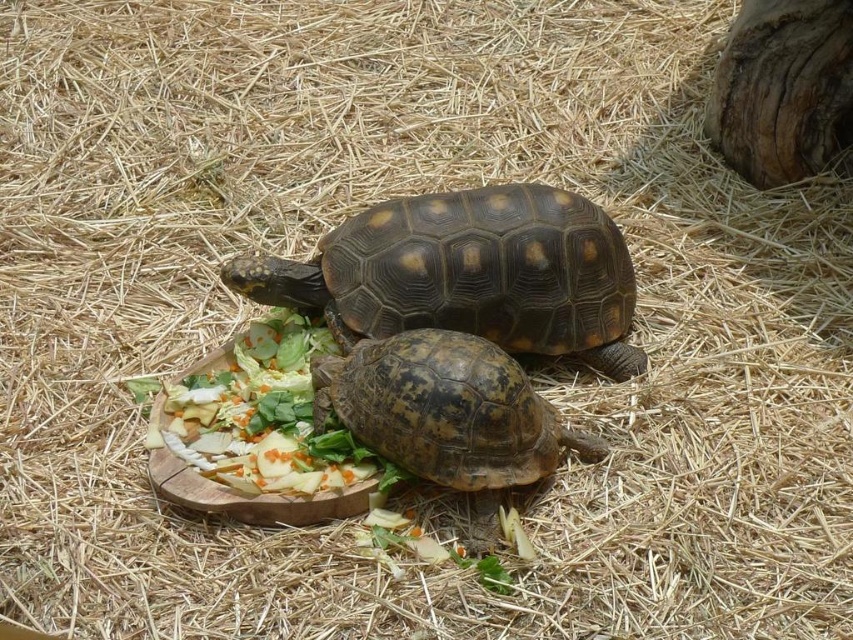
Question: Can you confirm if yellowish-brown textured shell at center is bigger than brown rough textured tortoise at center?

Choices:
 (A) no
 (B) yes

Answer: (B)

Question: Which object is farther from the camera taking this photo?

Choices:
 (A) brown rough textured tortoise at center
 (B) yellowish-brown textured shell at center
 (C) fresh green salad at center

Answer: (B)

Question: Does yellowish-brown textured shell at center appear over brown rough textured tortoise at center?

Choices:
 (A) no
 (B) yes

Answer: (B)

Question: Among these points, which one is farthest from the camera?

Choices:
 (A) (453, 428)
 (B) (495, 285)

Answer: (B)

Question: Is brown rough textured tortoise at center positioned at the back of fresh green salad at center?

Choices:
 (A) no
 (B) yes

Answer: (A)

Question: Which object is closer to the camera taking this photo?

Choices:
 (A) fresh green salad at center
 (B) yellowish-brown textured shell at center

Answer: (A)